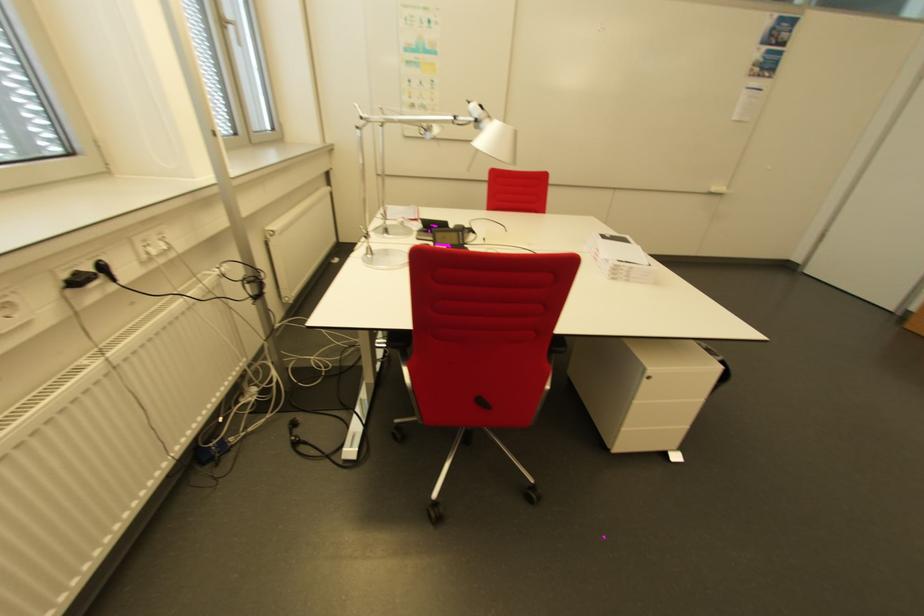
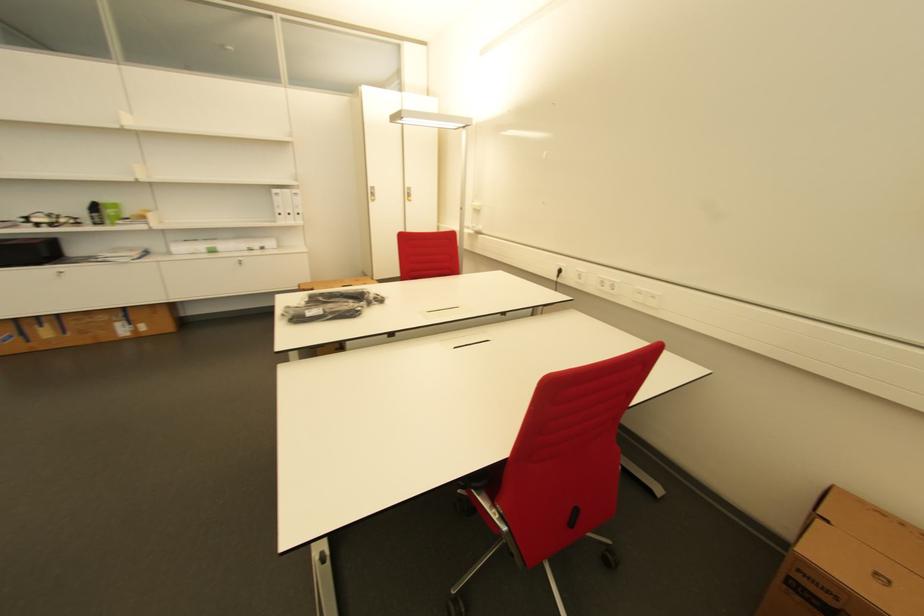
The first image is from the beginning of the video and the second image is from the end. How did the camera likely rotate when shooting the video?

The camera rotated toward right-down.